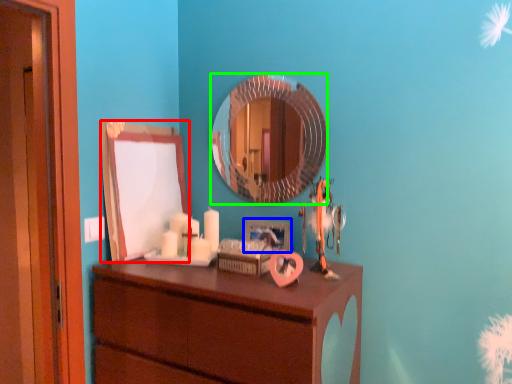
Question: Considering the real-world distances, which object is closest to mirror (highlighted by a red box)? picture frame (highlighted by a blue box) or mirror (highlighted by a green box).

Choices:
 (A) picture frame
 (B) mirror

Answer: (B)